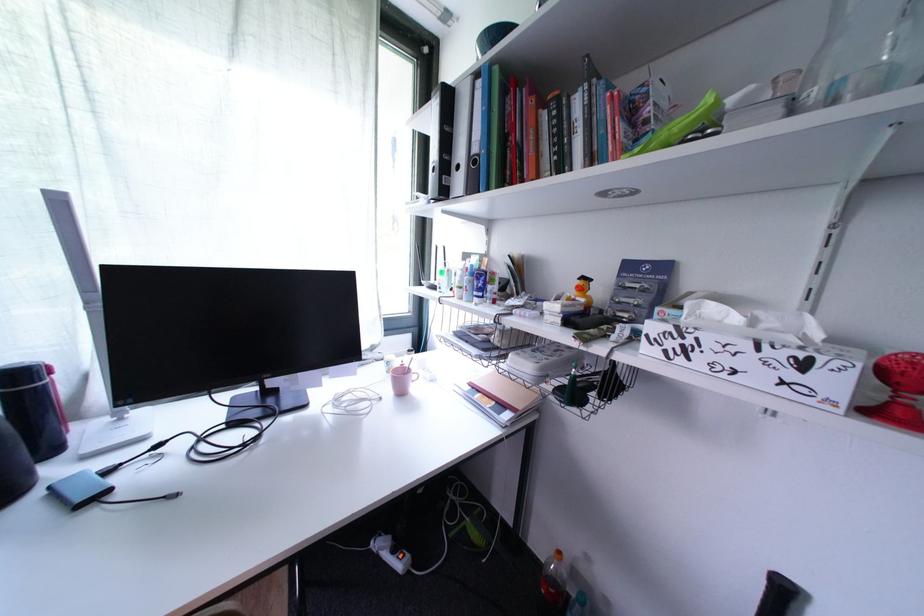
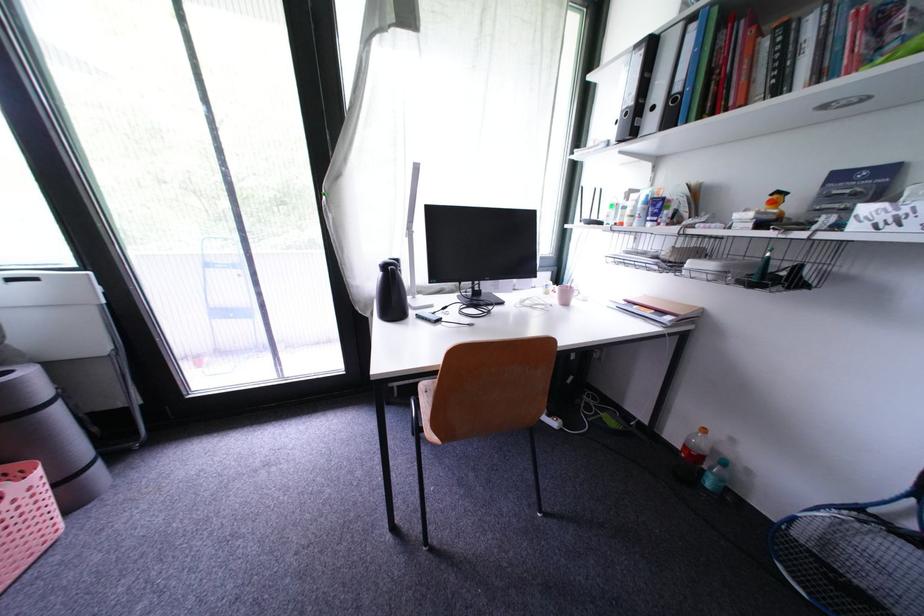
Locate, in the second image, the point that corresponds to pixel 421 379 in the first image.

(584, 296)